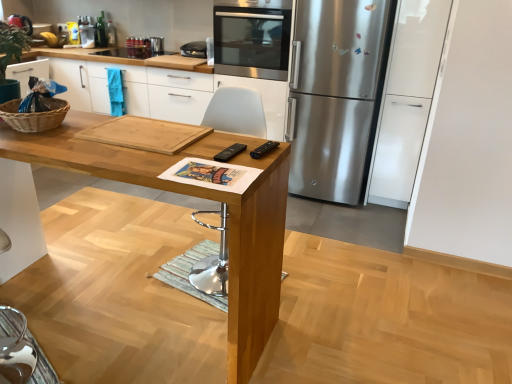
In order to click on vacant space in front of natural wood cutting board at center in this screenshot , I will do `click(134, 160)`.